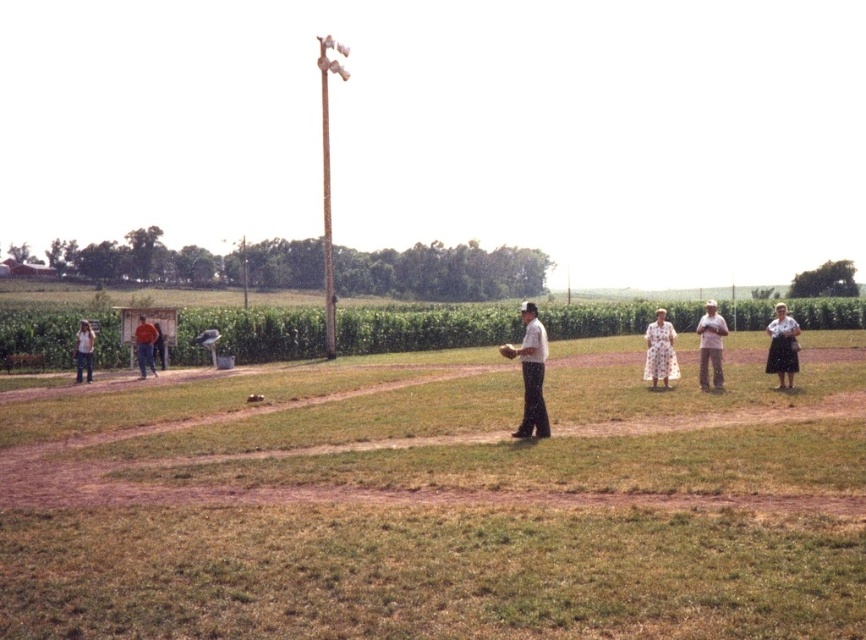
Question: Which point is closer to the camera taking this photo?

Choices:
 (A) (147, 324)
 (B) (700, 326)

Answer: (B)

Question: Among these objects, which one is nearest to the camera?

Choices:
 (A) brown leather glove at center
 (B) orange shirt at left
 (C) orange fabric shirt at left
 (D) white cotton dress at right

Answer: (A)

Question: In this image, where is white dotted dress at center located relative to light brown wooden baseball bat at left?

Choices:
 (A) left
 (B) right

Answer: (B)

Question: Is white cotton shirt at center further to the viewer compared to light brown wooden baseball bat at left?

Choices:
 (A) yes
 (B) no

Answer: (B)

Question: Is white cotton shirt at center to the right of white cotton dress at center from the viewer's perspective?

Choices:
 (A) yes
 (B) no

Answer: (B)

Question: Which object is farther from the camera taking this photo?

Choices:
 (A) white cotton dress at center
 (B) white cotton dress at right
 (C) white dotted dress at center

Answer: (C)